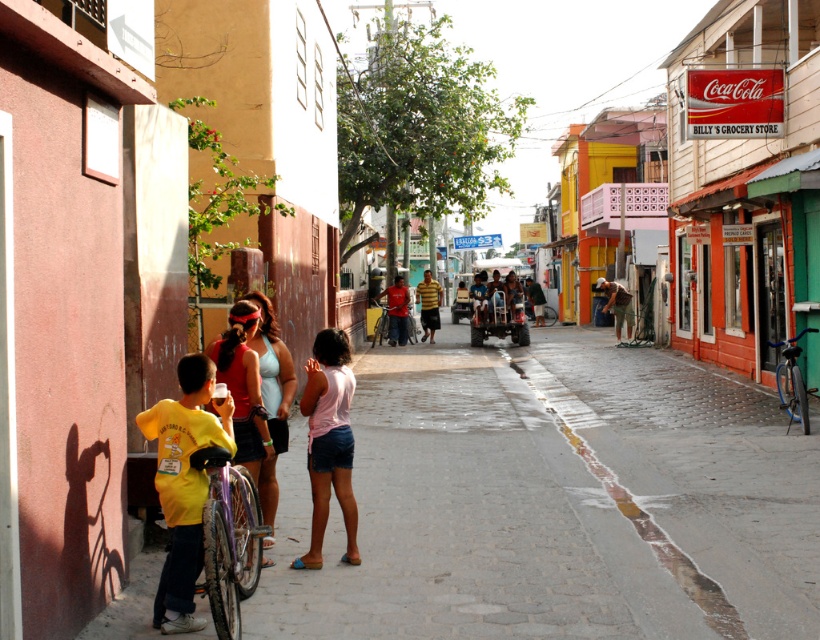
How far apart are yellow matte shirt at lower left and yellow striped shirt at center?

A distance of 64.85 feet exists between yellow matte shirt at lower left and yellow striped shirt at center.

Is point (172, 504) less distant than point (426, 323)?

That is True.

Is point (188, 572) farther from camera compared to point (422, 326)?

No, it is in front of (422, 326).

The height and width of the screenshot is (640, 820). Identify the location of yellow matte shirt at lower left. (184, 484).

Is pink cotton tank top at center shorter than matte blue shirt at center?

Indeed, pink cotton tank top at center has a lesser height compared to matte blue shirt at center.

From the picture: Measure the distance between point (311,385) and camera.

Point (311,385) is 5.94 meters away from camera.

Locate an element on the screen. pink cotton tank top at center is located at coordinates (329, 442).

This screenshot has height=640, width=820. I want to click on pink cotton tank top at center, so click(x=329, y=442).

Is pink cotton tank top at center closer to the viewer compared to brown leather jacket at center?

Yes, it is in front of brown leather jacket at center.

Between pink cotton tank top at center and brown leather jacket at center, which one appears on the right side from the viewer's perspective?

Positioned to the right is brown leather jacket at center.

Is point (351, 492) positioned behind point (616, 289)?

No, (351, 492) is in front of (616, 289).

At what (x,y) coordinates should I click in order to perform the action: click on pink cotton tank top at center. Please return your answer as a coordinate pair (x, y). Looking at the image, I should click on (329, 442).